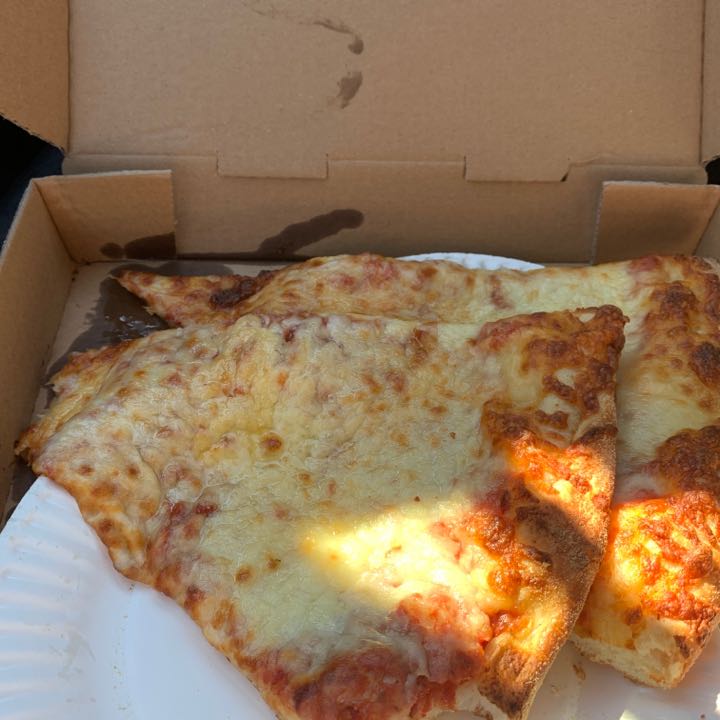
At what (x,y) coordinates should I click in order to perform the action: click on pizza box lid. Please return your answer as a coordinate pair (x, y). This screenshot has height=720, width=720. Looking at the image, I should click on (430, 72).